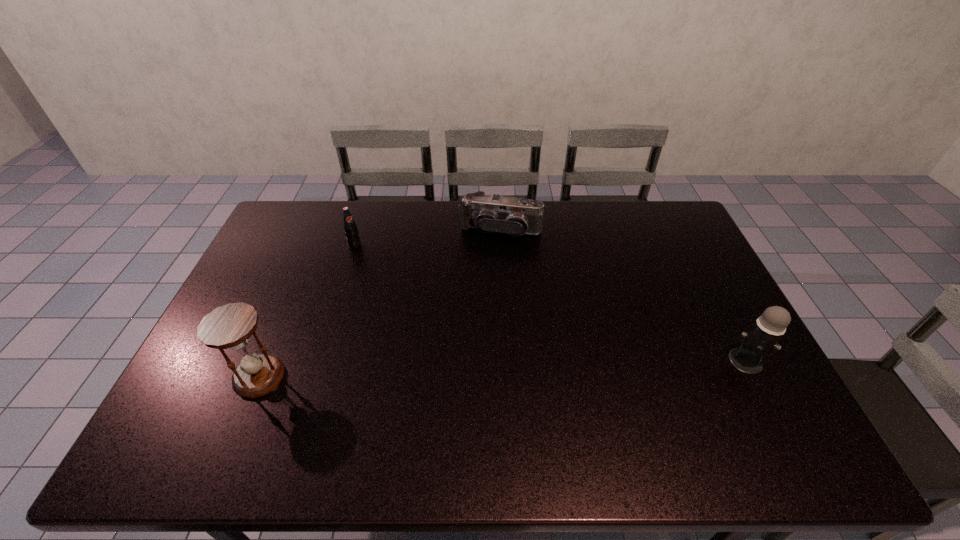
The width and height of the screenshot is (960, 540). In order to click on vacant space on the desktop that is between the leftmost object and the microphone and is positioned on the front-facing side of the camcorder in this screenshot , I will do `click(462, 370)`.

I want to click on vacant space on the desktop that is between the leftmost object and the microphone and is positioned on the front label of the pop, so click(x=484, y=369).